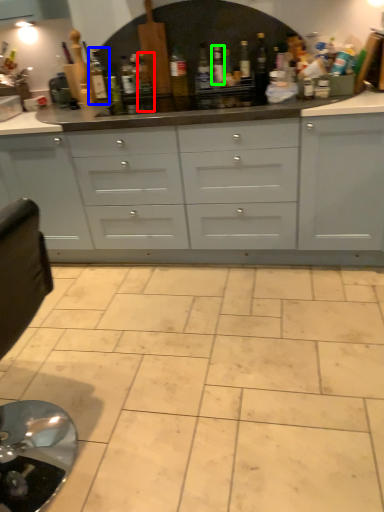
Question: Which is nearer to the bottle (highlighted by a red box)? bottle (highlighted by a blue box) or bottle (highlighted by a green box).

Choices:
 (A) bottle
 (B) bottle

Answer: (A)